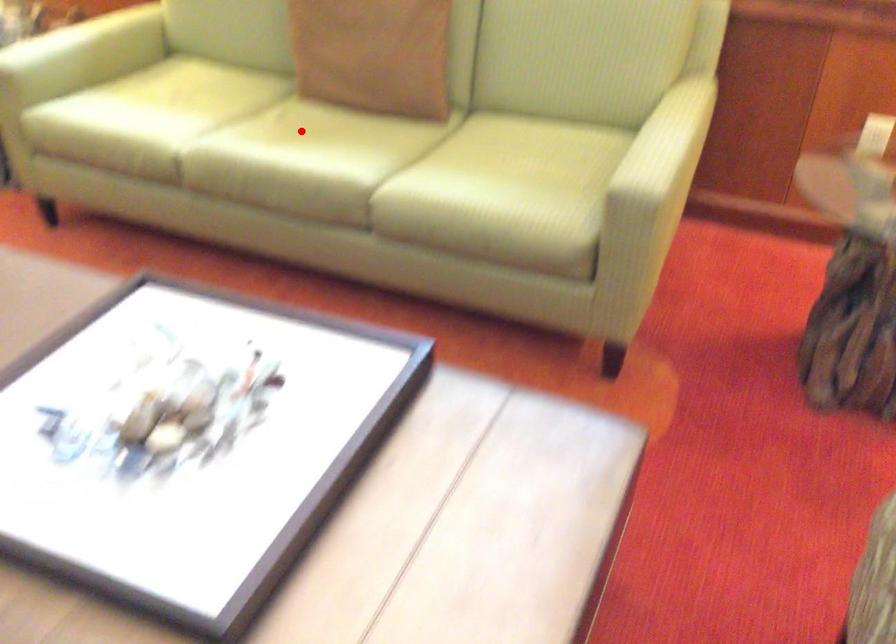
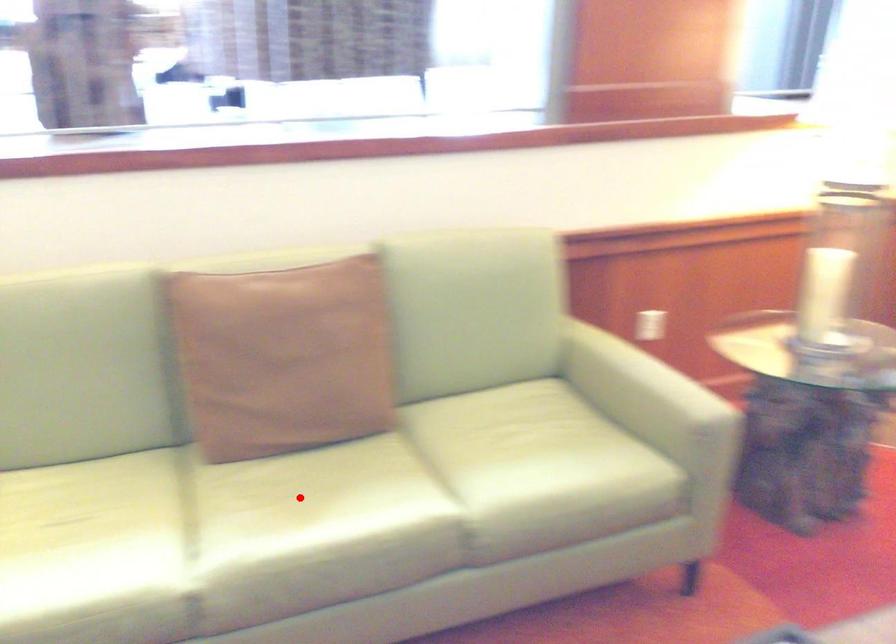
I am providing you with two images of the same scene from different viewpoints. A red point is marked on the first image and another point is marked on the second image. Do the highlighted points in image1 and image2 indicate the same real-world spot?

Yes